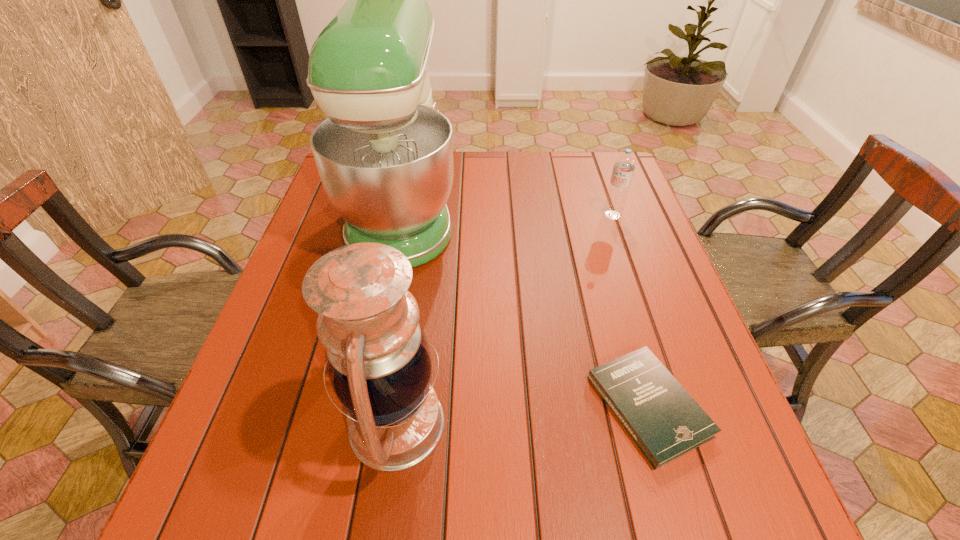
Locate an element on the screen. The image size is (960, 540). object that is positioned at the left edge is located at coordinates (384, 154).

You are a GUI agent. You are given a task and a screenshot of the screen. Output one action in this format:
    pyautogui.click(x=<x>, y=<y>)
    Task: Click on the water bottle that is at the right edge
    The width and height of the screenshot is (960, 540).
    Given the screenshot: What is the action you would take?
    pyautogui.click(x=624, y=165)

You are a GUI agent. You are given a task and a screenshot of the screen. Output one action in this format:
    pyautogui.click(x=<x>, y=<y>)
    Task: Click on the book that is positioned at the right edge
    Image resolution: width=960 pixels, height=540 pixels.
    Given the screenshot: What is the action you would take?
    pyautogui.click(x=665, y=422)

The height and width of the screenshot is (540, 960). In order to click on object at the far left corner in this screenshot , I will do `click(384, 154)`.

In the image, there is a desktop. Find the location of `vacant space at the far edge`. vacant space at the far edge is located at coordinates (523, 160).

The image size is (960, 540). Identify the location of free spot at the near edge of the desktop. (609, 521).

Where is `vacant area at the left edge`? The image size is (960, 540). vacant area at the left edge is located at coordinates (320, 205).

This screenshot has width=960, height=540. I want to click on vacant space at the right edge of the desktop, so click(690, 363).

This screenshot has width=960, height=540. I want to click on vacant space at the near right corner of the desktop, so click(x=712, y=491).

I want to click on free spot between the shortest object and the mixer, so click(x=526, y=308).